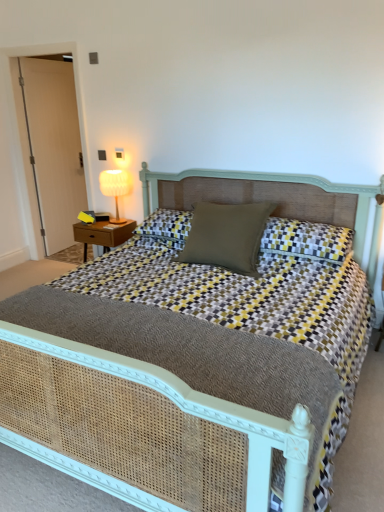
Question: From the image's perspective, relative to yellow-and-gray checkered pillow at center, the first pillow viewed from the right, is white wood door at left above or below?

Choices:
 (A) below
 (B) above

Answer: (B)

Question: In the image, is white wood door at left positioned in front of or behind yellow-and-gray checkered pillow at center, the 2th pillow when ordered from left to right?

Choices:
 (A) behind
 (B) front

Answer: (A)

Question: Which object is the closest to the white wood door at left?

Choices:
 (A) yellow-and-gray checkered pillow at center, the 2th pillow when ordered from left to right
 (B) wooden nightstand at left
 (C) matte green pillow at center, marked as the first pillow in a left-to-right arrangement
 (D) white fabric lampshade at upper left
 (E) woven cane bed at center

Answer: (D)

Question: Which object is positioned closest to the white wood door at left?

Choices:
 (A) matte green pillow at center, marked as the first pillow in a left-to-right arrangement
 (B) yellow-and-gray checkered pillow at center, the first pillow viewed from the right
 (C) woven cane bed at center
 (D) white fabric lampshade at upper left
 (E) wooden nightstand at left

Answer: (D)